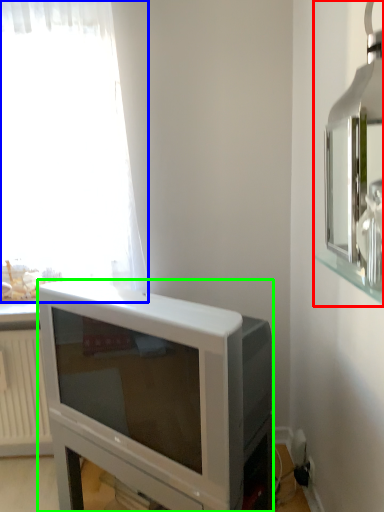
Question: Which object is positioned closest to medicine cabinet (highlighted by a red box)? Select from curtain (highlighted by a blue box) and television (highlighted by a green box).

Choices:
 (A) curtain
 (B) television

Answer: (B)